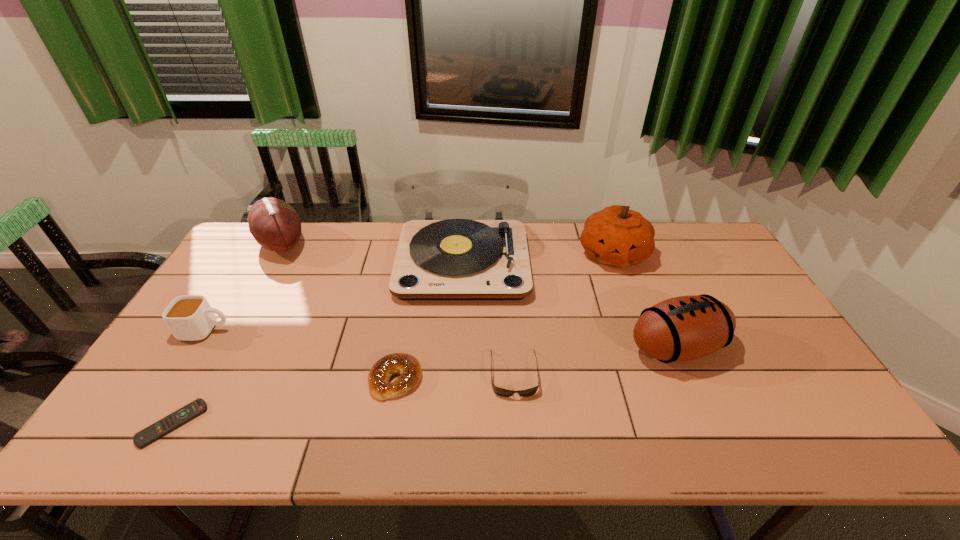
Identify the location of football (American) that is at the left edge. This screenshot has height=540, width=960. (275, 225).

Locate an element on the screen. cup positioned at the left edge is located at coordinates (189, 317).

Locate an element on the screen. remote control that is at the left edge is located at coordinates click(x=150, y=434).

Locate an element on the screen. The height and width of the screenshot is (540, 960). object that is positioned at the far left corner is located at coordinates point(275,225).

Find the location of a particular element. The image size is (960, 540). object that is positioned at the near left corner is located at coordinates (150, 434).

Identify the location of free point at the far edge. Image resolution: width=960 pixels, height=540 pixels. (333, 238).

The image size is (960, 540). Identify the location of free location at the near edge. (562, 424).

This screenshot has height=540, width=960. I want to click on vacant area at the left edge, so click(x=155, y=365).

Where is `free location at the right edge`? The image size is (960, 540). free location at the right edge is located at coordinates (743, 289).

Image resolution: width=960 pixels, height=540 pixels. I want to click on blank space at the far left corner of the desktop, so click(x=276, y=259).